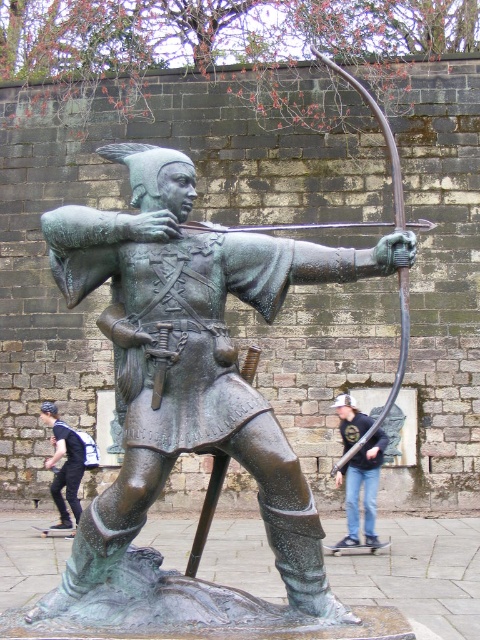
Between green patina bronze archer at center and dark blue jeans at lower left, which one is positioned higher?

green patina bronze archer at center is above.

What do you see at coordinates (191, 371) in the screenshot?
I see `green patina bronze archer at center` at bounding box center [191, 371].

Who is more forward, (189,195) or (60,525)?

Point (189,195) is more forward.

Where is `green patina bronze archer at center`? green patina bronze archer at center is located at coordinates (191, 371).

Measure the distance from green patina bronze archer at center to jeans at lower right.

green patina bronze archer at center is 13.96 meters away from jeans at lower right.

Is green patina bronze archer at center above jeans at lower right?

Yes, green patina bronze archer at center is above jeans at lower right.

Describe the element at coordinates (191, 371) in the screenshot. I see `green patina bronze archer at center` at that location.

This screenshot has width=480, height=640. What are the coordinates of `green patina bronze archer at center` in the screenshot? It's located at (191, 371).

In the scene shown: Which of these two, jeans at lower right or dark blue jeans at lower left, stands taller?

jeans at lower right

Who is lower down, jeans at lower right or dark blue jeans at lower left?

dark blue jeans at lower left is below.

Is point (376, 483) positioned after point (72, 467)?

No, (376, 483) is closer to viewer.

Identify the location of jeans at lower right. The width and height of the screenshot is (480, 640). (363, 490).